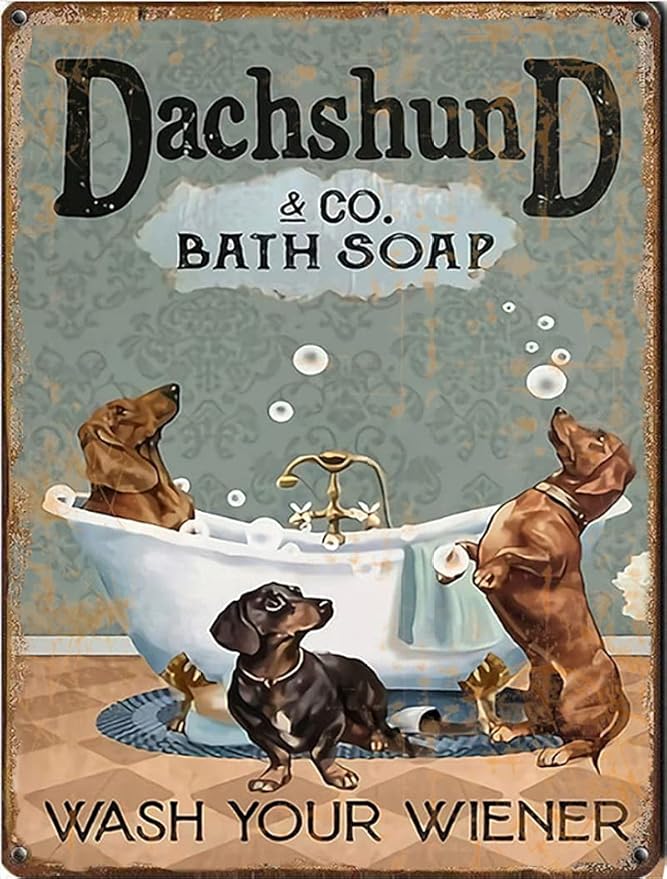
This screenshot has width=667, height=879. What are the coordinates of `floor` in the screenshot? It's located at (131, 759).